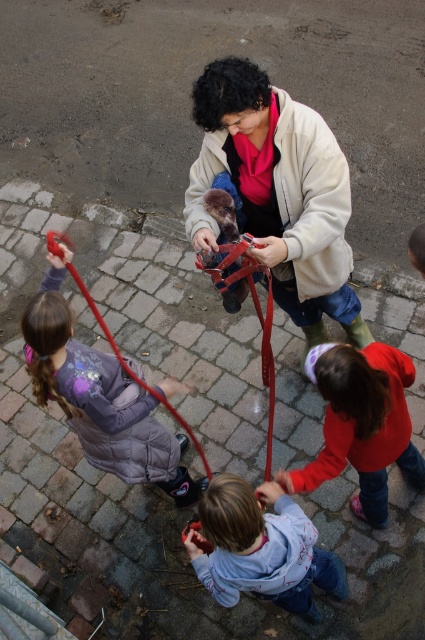
Question: Which object is closer to the camera taking this photo?

Choices:
 (A) furry brown dog at center
 (B) white fleece jacket at center
 (C) purple fuzzy jacket at lower left
 (D) light blue cotton shirt at center

Answer: (D)

Question: Can you confirm if white fleece jacket at center is thinner than red matte jacket at lower right?

Choices:
 (A) yes
 (B) no

Answer: (B)

Question: Where is white fleece jacket at center located in relation to purple fuzzy jacket at lower left in the image?

Choices:
 (A) above
 (B) below

Answer: (A)

Question: Which point is closer to the camera taking this photo?

Choices:
 (A) (226, 236)
 (B) (87, 416)
 (C) (413, 378)

Answer: (C)

Question: Which object is closer to the camera taking this photo?

Choices:
 (A) furry brown dog at center
 (B) light blue cotton shirt at center
 (C) red matte jacket at lower right
 (D) purple fuzzy jacket at lower left

Answer: (B)

Question: Is light blue cotton shirt at center positioned in front of red matte jacket at lower right?

Choices:
 (A) yes
 (B) no

Answer: (A)